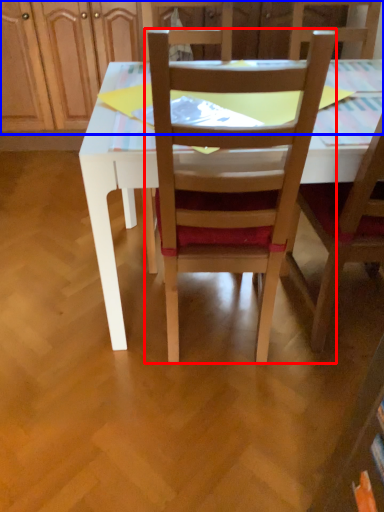
Question: Which of the following is the closest to the observer, chair (highlighted by a red box) or dresser (highlighted by a blue box)?

Choices:
 (A) chair
 (B) dresser

Answer: (A)